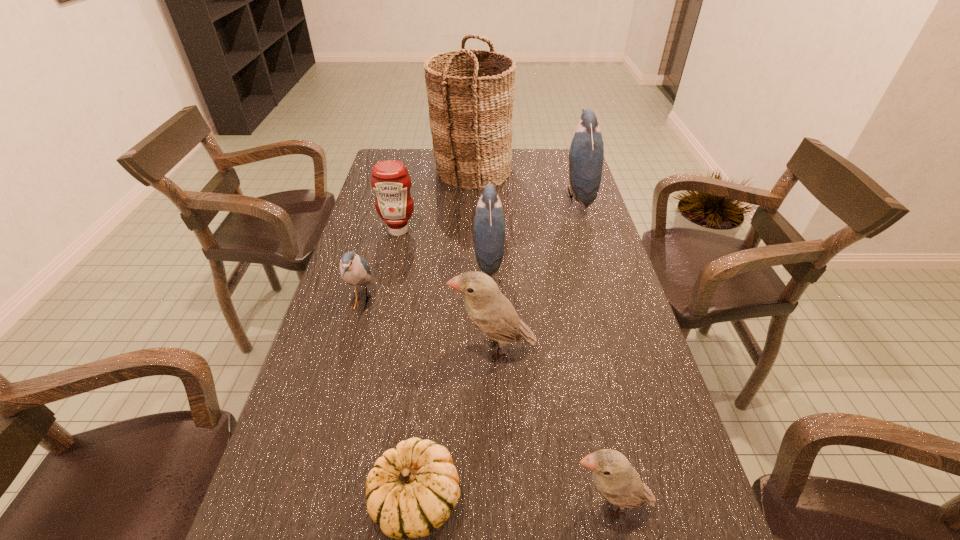
Locate an element on the screen. Image resolution: width=960 pixels, height=540 pixels. basket is located at coordinates (470, 114).

Where is `the tallest object`? This screenshot has height=540, width=960. the tallest object is located at coordinates (470, 114).

This screenshot has width=960, height=540. Find the location of `the tallest bird`. the tallest bird is located at coordinates (586, 153).

The width and height of the screenshot is (960, 540). Identify the location of the rightmost blue bird. (586, 153).

This screenshot has width=960, height=540. In order to click on the second biggest blue bird in this screenshot , I will do `click(489, 225)`.

The image size is (960, 540). I want to click on the bigger white bird, so click(x=489, y=310).

At what (x,y) coordinates should I click in order to perform the action: click on the farther white bird. Please return your answer as a coordinate pair (x, y). The height and width of the screenshot is (540, 960). Looking at the image, I should click on (489, 310).

This screenshot has width=960, height=540. Identify the location of red condiment. (390, 180).

The width and height of the screenshot is (960, 540). Identify the location of the third farthest object. (390, 180).

You are a GUI agent. You are given a task and a screenshot of the screen. Output one action in this format:
    pyautogui.click(x=<x>, y=<y>)
    Task: Click on the leftmost bird
    This screenshot has height=540, width=960.
    Given the screenshot: What is the action you would take?
    pyautogui.click(x=354, y=269)